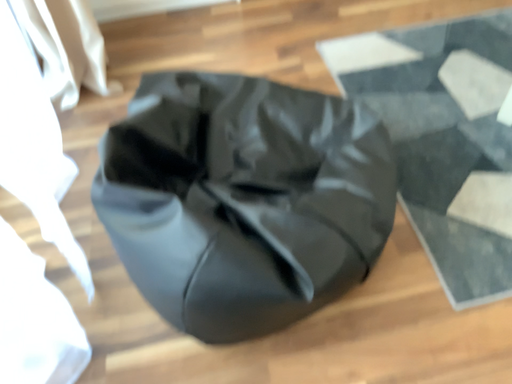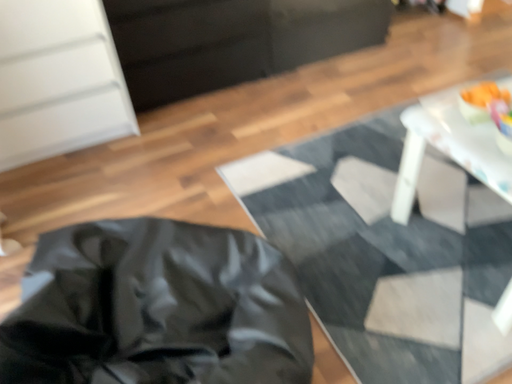
Question: Which way did the camera rotate in the video?

Choices:
 (A) rotated right
 (B) rotated left

Answer: (A)